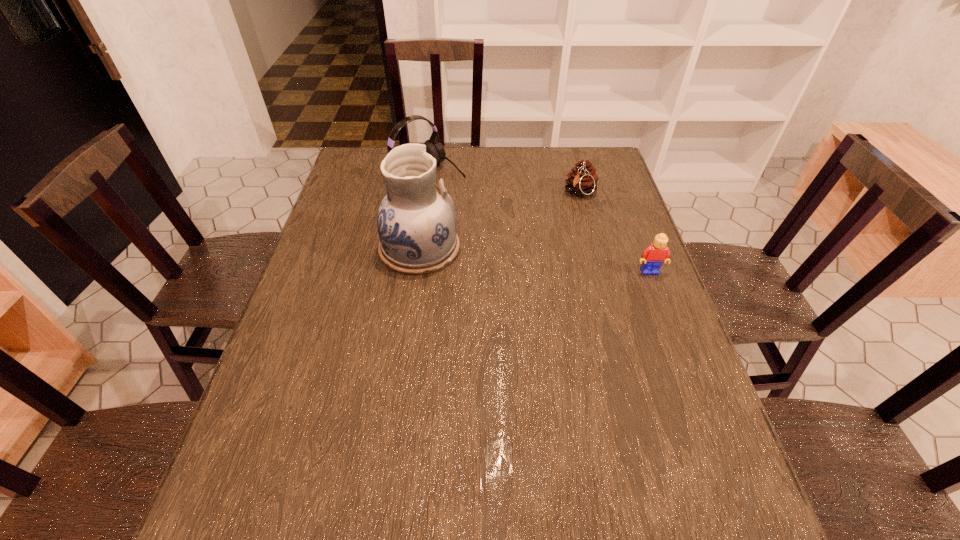
Identify the location of the tallest object. (416, 222).

Identify the location of the rightmost object. (653, 257).

Image resolution: width=960 pixels, height=540 pixels. Identify the location of pinecone. (582, 180).

Locate an element on the screen. The image size is (960, 540). headset is located at coordinates (433, 147).

Identify the location of vacant space located 0.060m on the back of the tallest object. 424,211.

Identify the location of vacant space located 0.070m on the front-facing side of the rightmost object. This screenshot has width=960, height=540. (659, 296).

This screenshot has height=540, width=960. I want to click on vacant space located with a leaf charm attached to the third object from left to right, so click(540, 264).

The image size is (960, 540). Find the location of `vacant space located with a leaf charm attached to the third object from left to right`. vacant space located with a leaf charm attached to the third object from left to right is located at coordinates (561, 230).

Find the location of `vacant space located with a leaf charm attached to the third object from left to right`. vacant space located with a leaf charm attached to the third object from left to right is located at coordinates (544, 257).

The height and width of the screenshot is (540, 960). I want to click on blank space located on the ear cushions of the headset, so click(505, 225).